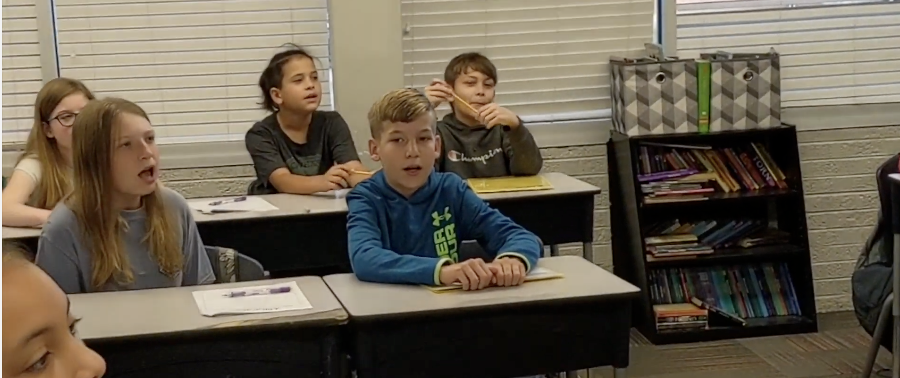
Locate an element on the screen. papers is located at coordinates (239, 301), (243, 203).